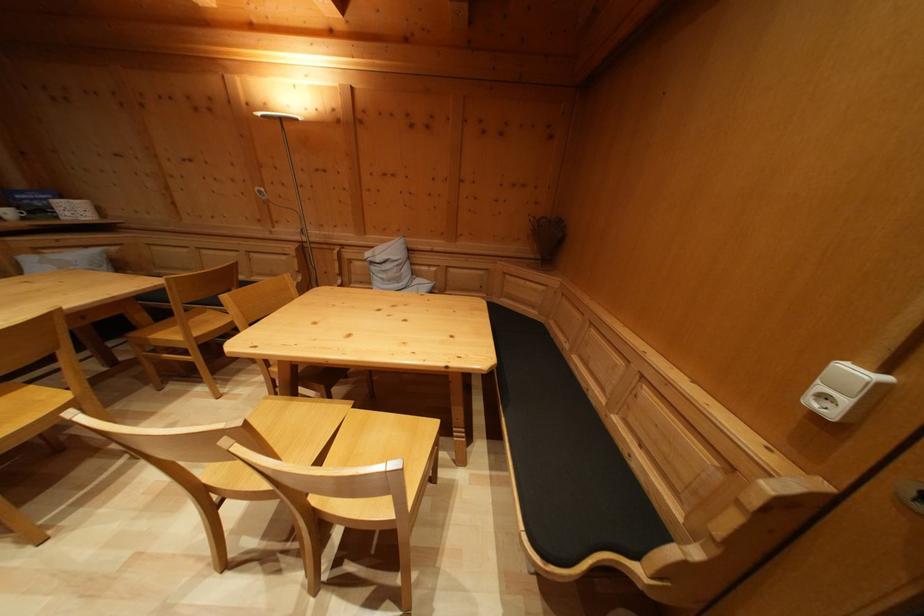
Find where to press the white light switch. Please return your answer as a coordinate pair (x, y).

(845, 392)